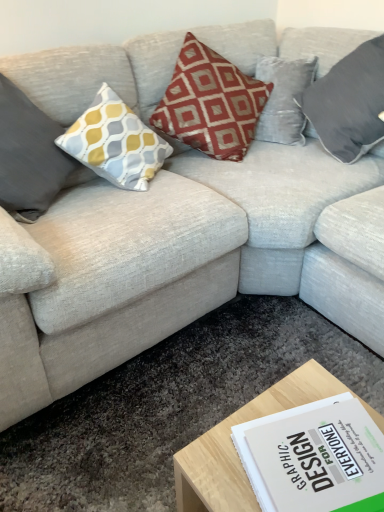
Where is `velvet gray pillow at upper right, positioned as the 3th pillow in left-to-right order`? The image size is (384, 512). velvet gray pillow at upper right, positioned as the 3th pillow in left-to-right order is located at coordinates (349, 102).

This screenshot has height=512, width=384. What do you see at coordinates (234, 448) in the screenshot? I see `light wood coffee table at lower center` at bounding box center [234, 448].

What do you see at coordinates (29, 156) in the screenshot?
I see `yellow-grey patterned cushion at left, placed as the third pillow when sorted from right to left` at bounding box center [29, 156].

Where is `velvet gray pillow at upper right, positioned as the 3th pillow in left-to-right order`? The image size is (384, 512). velvet gray pillow at upper right, positioned as the 3th pillow in left-to-right order is located at coordinates (349, 102).

Does point (267, 89) appear closer or farther from the camera than point (181, 482)?

Clearly, point (267, 89) is more distant from the camera than point (181, 482).

Is red velvet cushion at center, positioned as the second pillow in right-to-left order, in contact with light wood coffee table at lower center?

No, red velvet cushion at center, positioned as the second pillow in right-to-left order, is not making contact with light wood coffee table at lower center.

In terms of height, does red velvet cushion at center, positioned as the second pillow in right-to-left order, look taller or shorter compared to light wood coffee table at lower center?

Clearly, red velvet cushion at center, positioned as the second pillow in right-to-left order, is taller compared to light wood coffee table at lower center.

Is red velvet cushion at center, positioned as the second pillow in right-to-left order, at the right side of light wood coffee table at lower center?

Incorrect, red velvet cushion at center, positioned as the second pillow in right-to-left order, is not on the right side of light wood coffee table at lower center.

Can you confirm if light wood coffee table at lower center is positioned to the right of red velvet cushion at center, the second pillow positioned from the left?

Indeed, light wood coffee table at lower center is positioned on the right side of red velvet cushion at center, the second pillow positioned from the left.

Based on the photo, how far apart are light wood coffee table at lower center and red velvet cushion at center, the second pillow positioned from the left?

The distance of light wood coffee table at lower center from red velvet cushion at center, the second pillow positioned from the left, is 1.25 meters.

Can you tell me how much light wood coffee table at lower center and red velvet cushion at center, the second pillow positioned from the left, differ in facing direction?

light wood coffee table at lower center and red velvet cushion at center, the second pillow positioned from the left, are facing 92 degrees away from each other.

From the image's perspective, between light wood coffee table at lower center and red velvet cushion at center, positioned as the second pillow in right-to-left order, which one is located above?

red velvet cushion at center, positioned as the second pillow in right-to-left order, appears higher in the image.

In the image, is velvet gray pillow at upper right, positioned as the 3th pillow in left-to-right order, positioned in front of or behind red velvet cushion at center, positioned as the second pillow in right-to-left order?

velvet gray pillow at upper right, positioned as the 3th pillow in left-to-right order, is positioned farther from the viewer than red velvet cushion at center, positioned as the second pillow in right-to-left order.

Is velvet gray pillow at upper right, which appears as the 1th pillow when viewed from the right, at the right side of red velvet cushion at center, positioned as the second pillow in right-to-left order?

Yes.

How distant is velvet gray pillow at upper right, positioned as the 3th pillow in left-to-right order, from red velvet cushion at center, the second pillow positioned from the left?

40.37 centimeters.

Identify the location of the 1st pillow below the red velvet cushion at center, positioned as the second pillow in right-to-left order (from the image's perspective). (349, 102).

What's the angular difference between red velvet cushion at center, the second pillow positioned from the left, and yellow-grey patterned cushion at left, placed as the third pillow when sorted from right to left,'s facing directions?

red velvet cushion at center, the second pillow positioned from the left, and yellow-grey patterned cushion at left, placed as the third pillow when sorted from right to left, are facing 0.0013 degrees away from each other.

From the image's perspective, who appears lower, red velvet cushion at center, positioned as the second pillow in right-to-left order, or yellow-grey patterned cushion at left, the 1th pillow viewed from the left?

yellow-grey patterned cushion at left, the 1th pillow viewed from the left, from the image's perspective.

Looking at the image, does red velvet cushion at center, positioned as the second pillow in right-to-left order, seem bigger or smaller compared to yellow-grey patterned cushion at left, placed as the third pillow when sorted from right to left?

In the image, red velvet cushion at center, positioned as the second pillow in right-to-left order, appears to be larger than yellow-grey patterned cushion at left, placed as the third pillow when sorted from right to left.

Is point (216, 55) positioned behind point (51, 200)?

Yes, it is.

From a real-world perspective, is yellow-grey patterned cushion at left, the 1th pillow viewed from the left, physically located above or below velvet gray pillow at upper right, positioned as the 3th pillow in left-to-right order?

Clearly, from a real-world perspective, yellow-grey patterned cushion at left, the 1th pillow viewed from the left, is below velvet gray pillow at upper right, positioned as the 3th pillow in left-to-right order.

Is yellow-grey patterned cushion at left, the 1th pillow viewed from the left, thinner than velvet gray pillow at upper right, positioned as the 3th pillow in left-to-right order?

No, yellow-grey patterned cushion at left, the 1th pillow viewed from the left, is not thinner than velvet gray pillow at upper right, positioned as the 3th pillow in left-to-right order.

Considering the sizes of objects yellow-grey patterned cushion at left, the 1th pillow viewed from the left, and velvet gray pillow at upper right, positioned as the 3th pillow in left-to-right order, in the image provided, who is taller, yellow-grey patterned cushion at left, the 1th pillow viewed from the left, or velvet gray pillow at upper right, positioned as the 3th pillow in left-to-right order,?

yellow-grey patterned cushion at left, the 1th pillow viewed from the left, is taller.

Is yellow-grey patterned cushion at left, the 1th pillow viewed from the left, oriented away from velvet gray pillow at upper right, positioned as the 3th pillow in left-to-right order?

No, velvet gray pillow at upper right, positioned as the 3th pillow in left-to-right order, is not at the back of yellow-grey patterned cushion at left, the 1th pillow viewed from the left.

From the image's perspective, does velvet gray pillow at upper right, positioned as the 3th pillow in left-to-right order, appear lower than yellow-grey patterned cushion at left, placed as the third pillow when sorted from right to left?

No.

From a real-world perspective, is velvet gray pillow at upper right, which appears as the 1th pillow when viewed from the right, physically located above or below yellow-grey patterned cushion at left, placed as the third pillow when sorted from right to left?

Clearly, from a real-world perspective, velvet gray pillow at upper right, which appears as the 1th pillow when viewed from the right, is above yellow-grey patterned cushion at left, placed as the third pillow when sorted from right to left.

Is velvet gray pillow at upper right, positioned as the 3th pillow in left-to-right order, bigger than yellow-grey patterned cushion at left, the 1th pillow viewed from the left?

Indeed, velvet gray pillow at upper right, positioned as the 3th pillow in left-to-right order, has a larger size compared to yellow-grey patterned cushion at left, the 1th pillow viewed from the left.

Could you measure the distance between velvet gray pillow at upper right, positioned as the 3th pillow in left-to-right order, and yellow-grey patterned cushion at left, placed as the third pillow when sorted from right to left?

They are 1.15 meters apart.

Is red velvet cushion at center, positioned as the second pillow in right-to-left order, inside the boundaries of velvet gray pillow at upper right, positioned as the 3th pillow in left-to-right order, or outside?

red velvet cushion at center, positioned as the second pillow in right-to-left order, is spatially situated outside velvet gray pillow at upper right, positioned as the 3th pillow in left-to-right order.

Between point (240, 71) and point (366, 125), which one is positioned behind?

Positioned behind is point (240, 71).

Does red velvet cushion at center, the second pillow positioned from the left, turn towards velvet gray pillow at upper right, positioned as the 3th pillow in left-to-right order?

No, red velvet cushion at center, the second pillow positioned from the left, is not facing towards velvet gray pillow at upper right, positioned as the 3th pillow in left-to-right order.

Is red velvet cushion at center, the second pillow positioned from the left, to the right of velvet gray pillow at upper right, which appears as the 1th pillow when viewed from the right, from the viewer's perspective?

No.

The width and height of the screenshot is (384, 512). In order to click on coffee table to the right of red velvet cushion at center, positioned as the second pillow in right-to-left order in this screenshot , I will do `click(234, 448)`.

Where is `the 2nd pillow behind the light wood coffee table at lower center, starting your count from the anchor`? the 2nd pillow behind the light wood coffee table at lower center, starting your count from the anchor is located at coordinates (210, 103).

Which object lies further to the anchor point velvet gray pillow at upper right, positioned as the 3th pillow in left-to-right order, light wood coffee table at lower center or yellow-grey patterned cushion at left, placed as the third pillow when sorted from right to left?

Based on the image, light wood coffee table at lower center appears to be further to velvet gray pillow at upper right, positioned as the 3th pillow in left-to-right order.

From the image, which object appears to be farther from yellow-grey patterned cushion at left, the 1th pillow viewed from the left, velvet gray pillow at upper right, positioned as the 3th pillow in left-to-right order, or red velvet cushion at center, the second pillow positioned from the left?

Based on the image, velvet gray pillow at upper right, positioned as the 3th pillow in left-to-right order, appears to be further to yellow-grey patterned cushion at left, the 1th pillow viewed from the left.

In the scene shown: Considering their positions, is yellow-grey patterned cushion at left, placed as the third pillow when sorted from right to left, positioned further to light wood coffee table at lower center than red velvet cushion at center, positioned as the second pillow in right-to-left order?

red velvet cushion at center, positioned as the second pillow in right-to-left order, is further to light wood coffee table at lower center.

When comparing their distances from yellow-grey patterned cushion at left, the 1th pillow viewed from the left, does velvet gray pillow at upper right, positioned as the 3th pillow in left-to-right order, or light wood coffee table at lower center seem further?

velvet gray pillow at upper right, positioned as the 3th pillow in left-to-right order, is further to yellow-grey patterned cushion at left, the 1th pillow viewed from the left.

Looking at the image, which one is located further to velvet gray pillow at upper right, positioned as the 3th pillow in left-to-right order, yellow-grey patterned cushion at left, placed as the third pillow when sorted from right to left, or red velvet cushion at center, the second pillow positioned from the left?

yellow-grey patterned cushion at left, placed as the third pillow when sorted from right to left.

When comparing their distances from red velvet cushion at center, the second pillow positioned from the left, does yellow-grey patterned cushion at left, the 1th pillow viewed from the left, or velvet gray pillow at upper right, which appears as the 1th pillow when viewed from the right, seem further?

yellow-grey patterned cushion at left, the 1th pillow viewed from the left, lies further to red velvet cushion at center, the second pillow positioned from the left, than the other object.

From the image, which object appears to be nearer to light wood coffee table at lower center, red velvet cushion at center, the second pillow positioned from the left, or velvet gray pillow at upper right, which appears as the 1th pillow when viewed from the right?

Among the two, velvet gray pillow at upper right, which appears as the 1th pillow when viewed from the right, is located nearer to light wood coffee table at lower center.

Considering their positions, is yellow-grey patterned cushion at left, the 1th pillow viewed from the left, positioned closer to velvet gray pillow at upper right, which appears as the 1th pillow when viewed from the right, than light wood coffee table at lower center?

Among the two, yellow-grey patterned cushion at left, the 1th pillow viewed from the left, is located nearer to velvet gray pillow at upper right, which appears as the 1th pillow when viewed from the right.

Identify the location of pillow between yellow-grey patterned cushion at left, the 1th pillow viewed from the left, and velvet gray pillow at upper right, positioned as the 3th pillow in left-to-right order. (210, 103).

This screenshot has width=384, height=512. I want to click on coffee table between yellow-grey patterned cushion at left, the 1th pillow viewed from the left, and velvet gray pillow at upper right, which appears as the 1th pillow when viewed from the right, so click(234, 448).